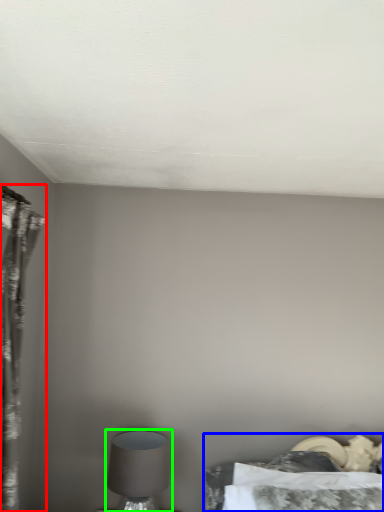
Question: Estimate the real-world distances between objects in this image. Which object is farther from curtain (highlighted by a red box), bed (highlighted by a blue box) or table lamp (highlighted by a green box)?

Choices:
 (A) bed
 (B) table lamp

Answer: (A)